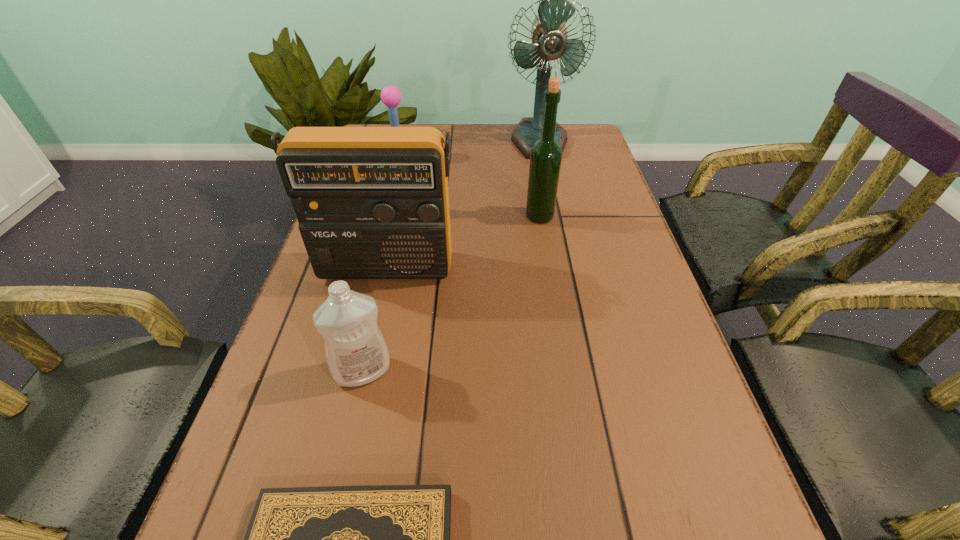
Identify the location of fan positioned at the far edge. (549, 34).

You are a GUI agent. You are given a task and a screenshot of the screen. Output one action in this format:
    pyautogui.click(x=<x>, y=<y>)
    Task: Click on the joystick present at the far edge
    The image size is (960, 540).
    Given the screenshot: What is the action you would take?
    pyautogui.click(x=390, y=95)

The width and height of the screenshot is (960, 540). What are the coordinates of `radio receiver situated at the left edge` in the screenshot? It's located at (372, 202).

Locate an element on the screen. The height and width of the screenshot is (540, 960). joystick present at the left edge is located at coordinates (390, 95).

Where is `detergent situated at the left edge`? This screenshot has height=540, width=960. detergent situated at the left edge is located at coordinates (356, 352).

Find the location of `object that is at the right edge`. object that is at the right edge is located at coordinates (549, 34).

Find the location of a particular element. Image resolution: width=960 pixels, height=540 pixels. object at the far left corner is located at coordinates (390, 95).

Image resolution: width=960 pixels, height=540 pixels. Identify the location of object that is at the far right corner. (549, 34).

Where is `vacant space at the far edge of the desktop`? Image resolution: width=960 pixels, height=540 pixels. vacant space at the far edge of the desktop is located at coordinates (482, 126).

Find the location of a particular element. The width and height of the screenshot is (960, 540). blank space at the left edge of the desktop is located at coordinates (329, 395).